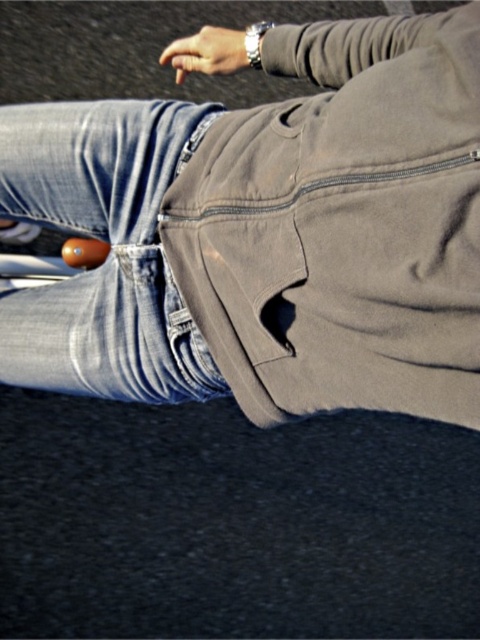
Question: Does matte khaki pants at center have a greater width compared to denim at center?

Choices:
 (A) no
 (B) yes

Answer: (A)

Question: Among these objects, which one is farthest from the camera?

Choices:
 (A) matte brown wristwatch at upper center
 (B) matte khaki pants at center
 (C) denim at center

Answer: (A)

Question: Does denim at center have a larger size compared to matte brown wristwatch at upper center?

Choices:
 (A) no
 (B) yes

Answer: (B)

Question: Can you confirm if matte khaki pants at center is thinner than matte brown wristwatch at upper center?

Choices:
 (A) no
 (B) yes

Answer: (A)

Question: Considering the real-world distances, which object is farthest from the matte brown wristwatch at upper center?

Choices:
 (A) denim at center
 (B) matte khaki pants at center

Answer: (B)

Question: Among these points, which one is nearest to the camera?

Choices:
 (A) (237, 58)
 (B) (334, 166)

Answer: (B)